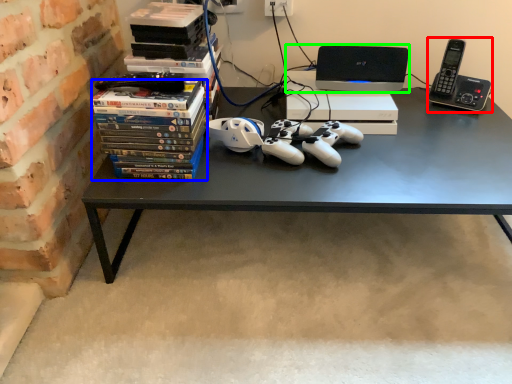
Question: Based on their relative distances, which object is nearer to gadget (highlighted by a red box)? Choose from book (highlighted by a blue box) and computer (highlighted by a green box).

Choices:
 (A) book
 (B) computer

Answer: (B)